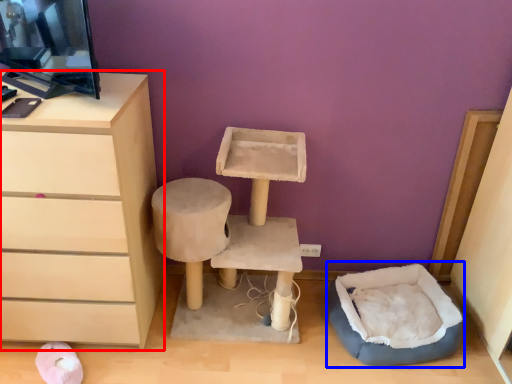
Question: Which point is closer to the camera, chest of drawers (highlighted by a red box) or bean bag chair (highlighted by a blue box)?

Choices:
 (A) chest of drawers
 (B) bean bag chair

Answer: (A)